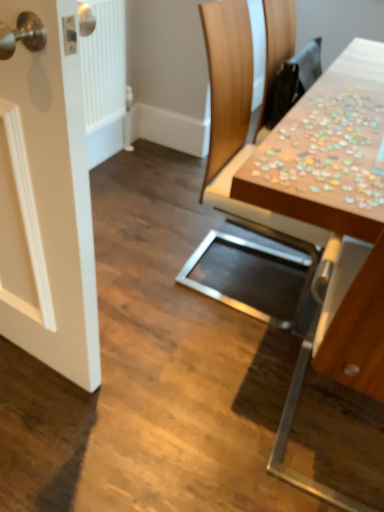
Describe the element at coordinates (334, 208) in the screenshot. The image size is (384, 512). I see `wooden puzzle pieces at upper right` at that location.

What do you see at coordinates (238, 168) in the screenshot? Image resolution: width=384 pixels, height=512 pixels. I see `wooden chair at upper right` at bounding box center [238, 168].

Identify the location of wooden puzzle pieces at upper right. The image size is (384, 512). (327, 150).

From a real-world perspective, who is located lower, wooden chair at upper right or wooden puzzle pieces at upper right?

wooden chair at upper right, from a real-world perspective.

Considering their positions, is wooden chair at upper right located in front of or behind wooden puzzle pieces at upper right?

Visually, wooden chair at upper right is located in front of wooden puzzle pieces at upper right.

Looking at their sizes, would you say wooden chair at upper right is wider or thinner than wooden puzzle pieces at upper right?

Considering their sizes, wooden chair at upper right looks broader than wooden puzzle pieces at upper right.

From the image's perspective, is wooden chair at upper right located above or below wooden puzzle pieces at upper right?

From the image's perspective, wooden chair at upper right appears below wooden puzzle pieces at upper right.

Find the location of a particular element. This screenshot has width=384, height=512. counter top on the right of wooden puzzle pieces at upper right is located at coordinates (327, 150).

Would you say wooden puzzle pieces at upper right is to the left or to the right of wooden puzzle pieces at upper right in the picture?

In the image, wooden puzzle pieces at upper right appears on the left side of wooden puzzle pieces at upper right.

How different are the orientations of wooden puzzle pieces at upper right and wooden puzzle pieces at upper right in degrees?

They differ by 91.3 degrees in their facing directions.

Consider the image. From a real-world perspective, which is physically above, wooden puzzle pieces at upper right or wooden puzzle pieces at upper right?

In real-world perspective, wooden puzzle pieces at upper right is above.

From the image's perspective, does wooden chair at upper right appear lower than wooden puzzle pieces at upper right?

No, from the image's perspective, wooden chair at upper right is not below wooden puzzle pieces at upper right.

Is the position of wooden chair at upper right less distant than that of wooden puzzle pieces at upper right?

No, it is behind wooden puzzle pieces at upper right.

Which object is positioned more to the left, wooden chair at upper right or wooden puzzle pieces at upper right?

Positioned to the left is wooden chair at upper right.

Which object is positioned more to the left, wooden puzzle pieces at upper right or wooden chair at upper right?

Positioned to the left is wooden chair at upper right.

Which is correct: wooden puzzle pieces at upper right is inside wooden chair at upper right, or outside of it?

wooden puzzle pieces at upper right exists outside the volume of wooden chair at upper right.

From the image's perspective, is wooden puzzle pieces at upper right over wooden chair at upper right?

Indeed, from the image's perspective, wooden puzzle pieces at upper right is shown above wooden chair at upper right.

From a real-world perspective, between wooden puzzle pieces at upper right and wooden chair at upper right, who is vertically lower?

From a 3D spatial view, wooden chair at upper right is below.

Can you tell me how much wooden puzzle pieces at upper right and wooden puzzle pieces at upper right differ in facing direction?

The angular difference between wooden puzzle pieces at upper right and wooden puzzle pieces at upper right is 91.3 degrees.

Consider the image. From a real-world perspective, is wooden puzzle pieces at upper right positioned over wooden puzzle pieces at upper right based on gravity?

No.

Is wooden puzzle pieces at upper right looking in the opposite direction of wooden puzzle pieces at upper right?

No, wooden puzzle pieces at upper right is not facing away from wooden puzzle pieces at upper right.

Who is bigger, wooden puzzle pieces at upper right or wooden puzzle pieces at upper right?

Bigger between the two is wooden puzzle pieces at upper right.

Is wooden puzzle pieces at upper right oriented away from wooden chair at upper right?

wooden puzzle pieces at upper right does not have its back to wooden chair at upper right.

Looking at this image, from the image's perspective, is wooden puzzle pieces at upper right positioned above or below wooden chair at upper right?

From the image's perspective, wooden puzzle pieces at upper right appears below wooden chair at upper right.

Considering the points (375, 344) and (247, 88), which point is in front, point (375, 344) or point (247, 88)?

Point (375, 344)

Which object is positioned more to the left, wooden puzzle pieces at upper right or wooden chair at upper right?

Positioned to the left is wooden chair at upper right.

Where is `counter top on the right side of wooden chair at upper right`? This screenshot has width=384, height=512. counter top on the right side of wooden chair at upper right is located at coordinates click(x=327, y=150).

Find the location of a particular element. The height and width of the screenshot is (512, 384). counter top behind the wooden puzzle pieces at upper right is located at coordinates (327, 150).

Looking at the image, which one is located further to wooden puzzle pieces at upper right, wooden puzzle pieces at upper right or wooden chair at upper right?

Based on the image, wooden chair at upper right appears to be further to wooden puzzle pieces at upper right.

Which object lies nearer to the anchor point wooden chair at upper right, wooden puzzle pieces at upper right or wooden puzzle pieces at upper right?

wooden puzzle pieces at upper right is positioned closer to the anchor wooden chair at upper right.

Looking at the image, which one is located further to wooden chair at upper right, wooden puzzle pieces at upper right or wooden puzzle pieces at upper right?

wooden puzzle pieces at upper right lies further to wooden chair at upper right than the other object.

From the image, which object appears to be farther from wooden puzzle pieces at upper right, wooden puzzle pieces at upper right or wooden chair at upper right?

wooden chair at upper right is positioned further to the anchor wooden puzzle pieces at upper right.

Considering their positions, is wooden chair at upper right positioned closer to wooden puzzle pieces at upper right than wooden puzzle pieces at upper right?

wooden puzzle pieces at upper right lies closer to wooden puzzle pieces at upper right than the other object.

Which object lies further to the anchor point wooden puzzle pieces at upper right, wooden chair at upper right or wooden puzzle pieces at upper right?

wooden chair at upper right lies further to wooden puzzle pieces at upper right than the other object.

Identify the location of chair located between wooden puzzle pieces at upper right and wooden puzzle pieces at upper right in the depth direction. (238, 168).